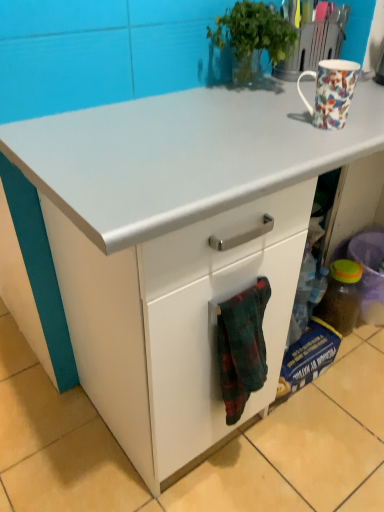
Find the location of `unoccupied space behind floral porcelain mug at upper right`. unoccupied space behind floral porcelain mug at upper right is located at coordinates (293, 100).